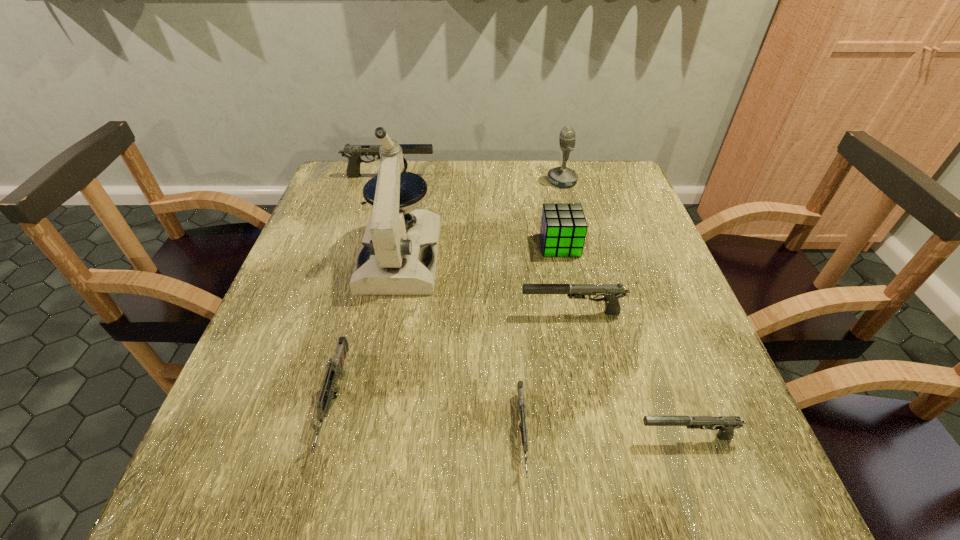
You are a GUI agent. You are given a task and a screenshot of the screen. Output one action in this format:
    pyautogui.click(x=<x>, y=<y>)
    Task: Click on the gray gun that is the third closest to the cube
    The height and width of the screenshot is (540, 960).
    Given the screenshot: What is the action you would take?
    pyautogui.click(x=725, y=424)

Point out which gray gun is positioned as the second nearest to the nearest gray gun. Please provide its 2D coordinates. Your answer should be formatted as a tuple, i.e. [(x, y)], where the tuple contains the x and y coordinates of a point satisfying the conditions above.

[(353, 152)]

Image resolution: width=960 pixels, height=540 pixels. Find the location of `free space that satisfies the following two spatial constraints: 1. on the front-facing side of the microphone; 2. on the front side of the red cube`. free space that satisfies the following two spatial constraints: 1. on the front-facing side of the microphone; 2. on the front side of the red cube is located at coordinates (578, 245).

Locate an element on the screen. The image size is (960, 540). vacant space that satisfies the following two spatial constraints: 1. at the muzzle end of the fifth farthest object; 2. aimed along the barrel of the bigger grey gun is located at coordinates (590, 402).